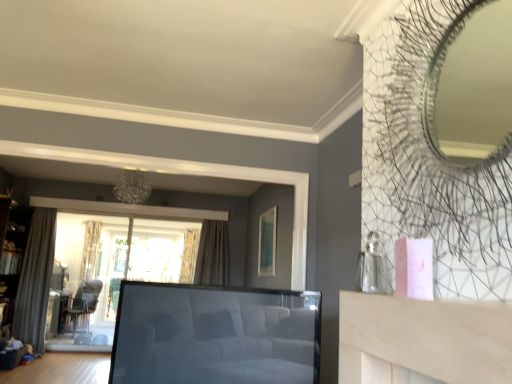
Question: Considering the relative sizes of wooden bookshelf at left and dark brown leather armchair at lower left in the image provided, is wooden bookshelf at left wider than dark brown leather armchair at lower left?

Choices:
 (A) yes
 (B) no

Answer: (B)

Question: Is wooden bookshelf at left in front of dark brown leather armchair at lower left?

Choices:
 (A) yes
 (B) no

Answer: (A)

Question: Considering the relative sizes of wooden bookshelf at left and dark brown leather armchair at lower left in the image provided, is wooden bookshelf at left taller than dark brown leather armchair at lower left?

Choices:
 (A) no
 (B) yes

Answer: (B)

Question: Is wooden bookshelf at left to the right of dark brown leather armchair at lower left from the viewer's perspective?

Choices:
 (A) no
 (B) yes

Answer: (A)

Question: Is wooden bookshelf at left looking in the opposite direction of dark brown leather armchair at lower left?

Choices:
 (A) yes
 (B) no

Answer: (B)

Question: Does wooden bookshelf at left appear on the left side of dark brown leather armchair at lower left?

Choices:
 (A) yes
 (B) no

Answer: (A)

Question: Considering the relative sizes of white leather studio couch at center and matte green picture frame at upper center in the image provided, is white leather studio couch at center shorter than matte green picture frame at upper center?

Choices:
 (A) no
 (B) yes

Answer: (B)

Question: Is white leather studio couch at center aimed at matte green picture frame at upper center?

Choices:
 (A) yes
 (B) no

Answer: (B)

Question: Can you confirm if white leather studio couch at center is wider than matte green picture frame at upper center?

Choices:
 (A) yes
 (B) no

Answer: (A)

Question: Is white leather studio couch at center outside matte green picture frame at upper center?

Choices:
 (A) yes
 (B) no

Answer: (A)

Question: From a real-world perspective, is white leather studio couch at center on matte green picture frame at upper center?

Choices:
 (A) yes
 (B) no

Answer: (B)

Question: Is white leather studio couch at center positioned before matte green picture frame at upper center?

Choices:
 (A) no
 (B) yes

Answer: (B)

Question: From a real-world perspective, does patterned fabric curtain at center, the 3th curtain in the left-to-right sequence, sit lower than matte green picture frame at upper center?

Choices:
 (A) no
 (B) yes

Answer: (B)